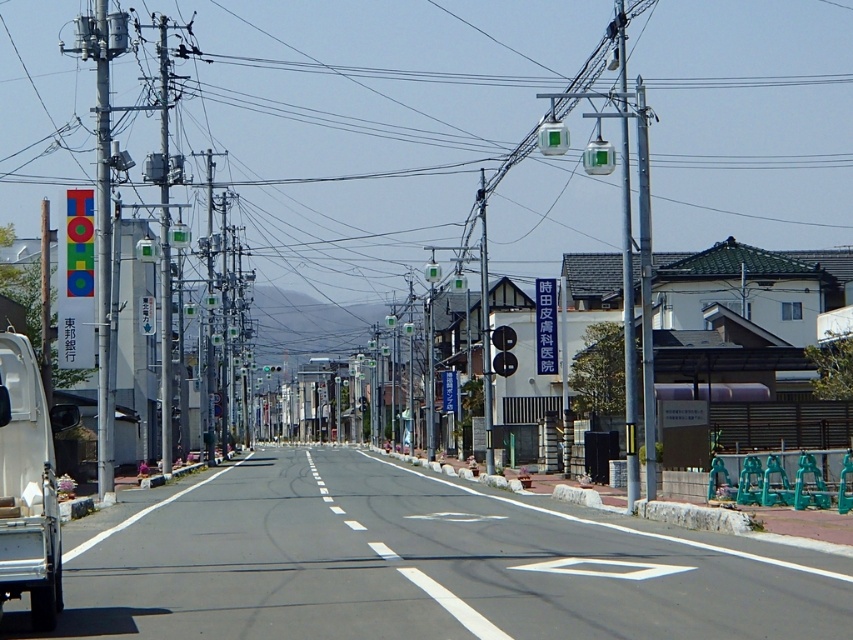
Based on the photo, is metallic gray pole at center-right behind metallic pole at center?

No, it is in front of metallic pole at center.

Locate an element on the screen. This screenshot has width=853, height=640. metallic gray pole at center-right is located at coordinates (645, 289).

Can you confirm if metallic pole at center is positioned above black plastic traffic light at center?

Correct, metallic pole at center is located above black plastic traffic light at center.

Can you confirm if metallic pole at center is taller than black plastic traffic light at center?

Yes, metallic pole at center is taller than black plastic traffic light at center.

Is point (486, 339) positioned in front of point (512, 330)?

Yes, it is in front of point (512, 330).

At what (x,y) coordinates should I click in order to perform the action: click on metallic pole at center. Please return your answer as a coordinate pair (x, y). Looking at the image, I should click on (485, 326).

In the scene shown: Does white matte truck at left come behind metallic pole at center?

No, white matte truck at left is closer to the viewer.

From the picture: Who is taller, white matte truck at left or metallic pole at center?

With more height is metallic pole at center.

Who is more forward, (26, 582) or (485, 218)?

Point (26, 582)

Where is `white matte truck at left`? white matte truck at left is located at coordinates (28, 483).